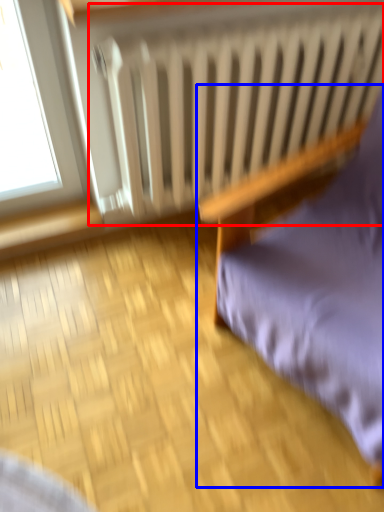
Question: Which of the following is the closest to the observer, radiator (highlighted by a red box) or furniture (highlighted by a blue box)?

Choices:
 (A) radiator
 (B) furniture

Answer: (B)